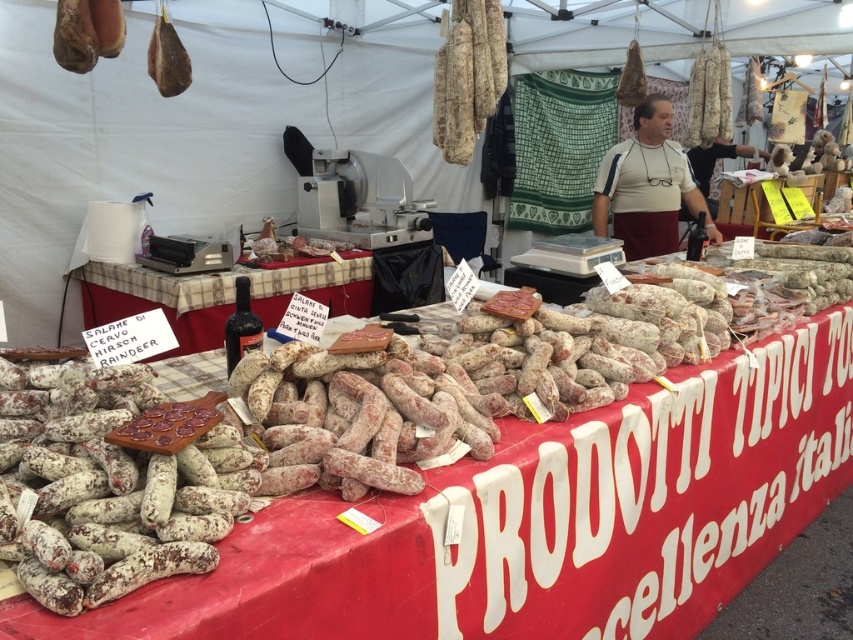
You are a customer at the market stall and want to buy the speckled white sausage at center and the matte brown cured meat at upper left. The vendor asks you to point out which one is on the right side. Which one should you indicate?

You should indicate the speckled white sausage at center because it is positioned on the right side of the matte brown cured meat at upper left.

Consider the image. You are a customer at the market stall and want to place an order. Which item, the plaid fabric table at center or the white fabric apron at center, has a greater width?

The plaid fabric table at center has a greater width than the white fabric apron at center.